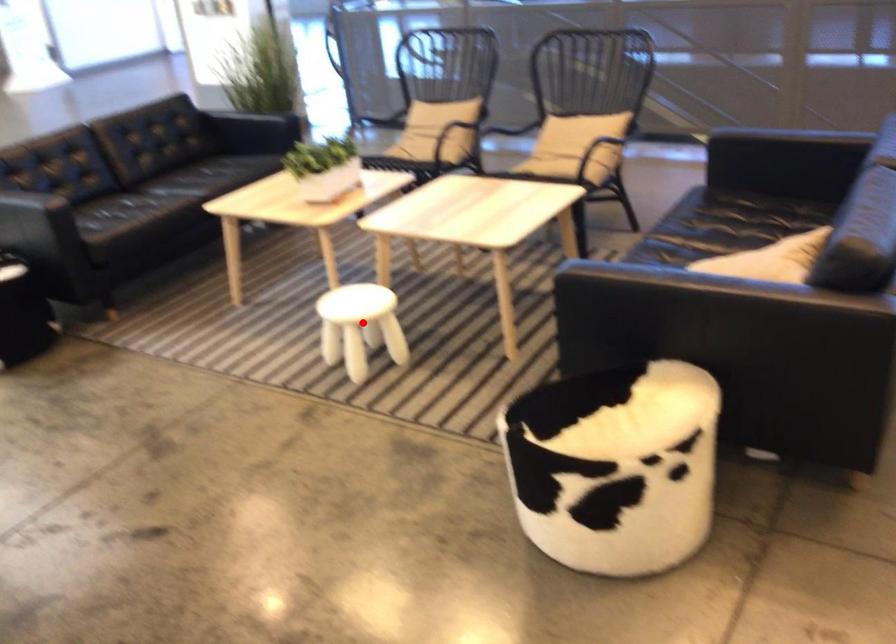
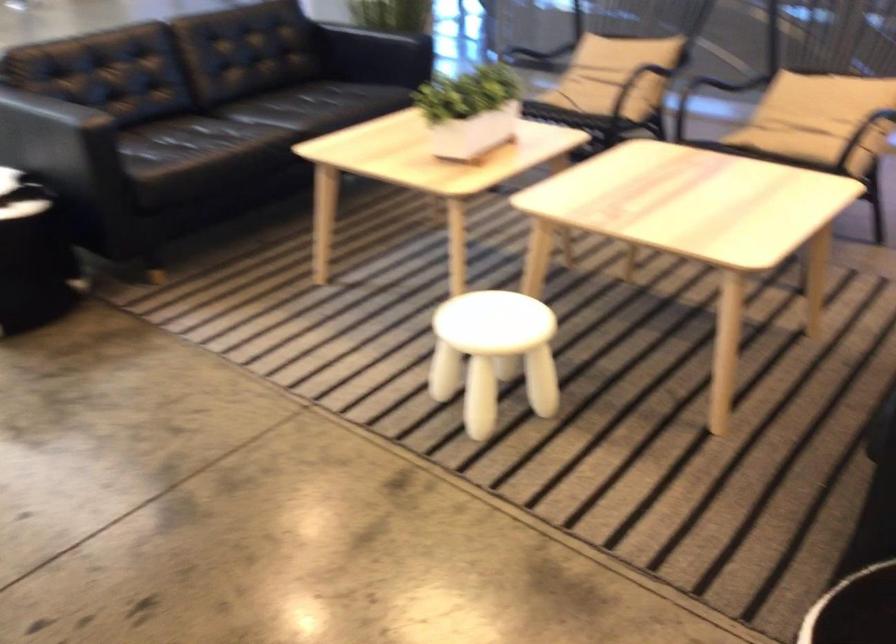
Question: A red point is marked in image1. In image2, is the corresponding 3D point closer to the camera or farther? Reply with the corresponding letter.

Choices:
 (A) The corresponding 3D point is closer.
 (B) The corresponding 3D point is farther.

Answer: (A)